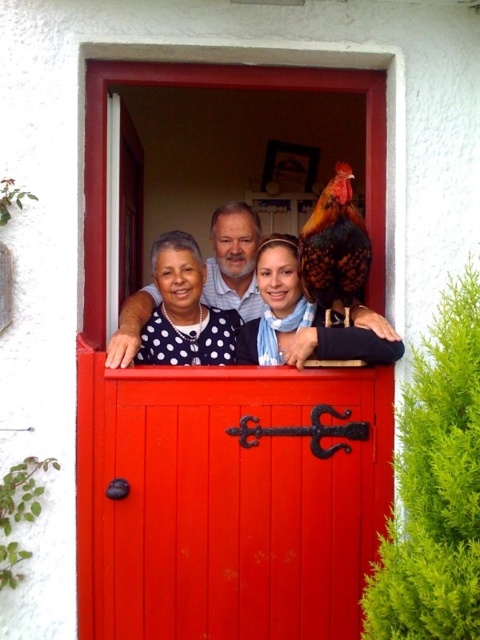
Is smooth glossy wood door at center wider than polka dot blouse at center?

Yes, smooth glossy wood door at center is wider than polka dot blouse at center.

Between smooth glossy wood door at center and polka dot blouse at center, which one is positioned lower?

smooth glossy wood door at center

Describe the element at coordinates (228, 499) in the screenshot. Image resolution: width=480 pixels, height=640 pixels. I see `smooth glossy wood door at center` at that location.

Where is `smooth glossy wood door at center`? This screenshot has height=640, width=480. smooth glossy wood door at center is located at coordinates (228, 499).

Does smooth glossy wood door at center have a smaller size compared to matte black scarf at center?

Correct, smooth glossy wood door at center occupies less space than matte black scarf at center.

Does smooth glossy wood door at center appear on the right side of matte black scarf at center?

Incorrect, smooth glossy wood door at center is not on the right side of matte black scarf at center.

Is point (122, 611) positioned before point (300, 296)?

Yes, point (122, 611) is closer to viewer.

Where is `smooth glossy wood door at center`? Image resolution: width=480 pixels, height=640 pixels. smooth glossy wood door at center is located at coordinates (x=228, y=499).

Between white dotted dress at center and polka dot blouse at center, which one has more height?

white dotted dress at center is taller.

Is white dotted dress at center positioned at the back of polka dot blouse at center?

Yes.

Between point (180, 253) and point (132, 305), which one is positioned behind?

Positioned behind is point (132, 305).

Locate an element on the screen. The image size is (480, 640). white dotted dress at center is located at coordinates (184, 310).